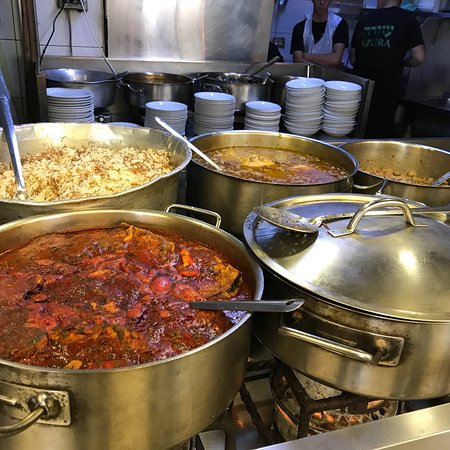
Image resolution: width=450 pixels, height=450 pixels. What are the coordinates of `pot lid` in the screenshot? It's located at (344, 271).